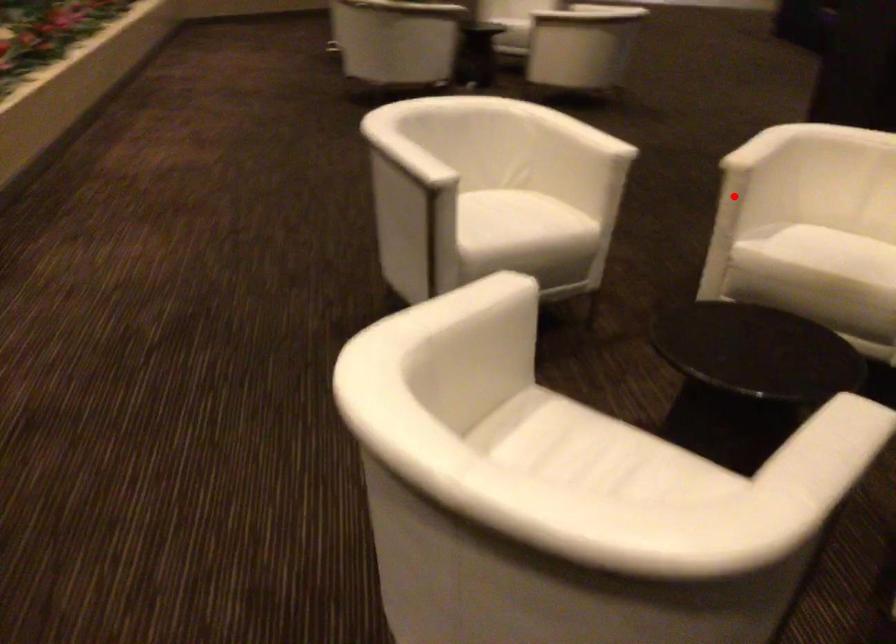
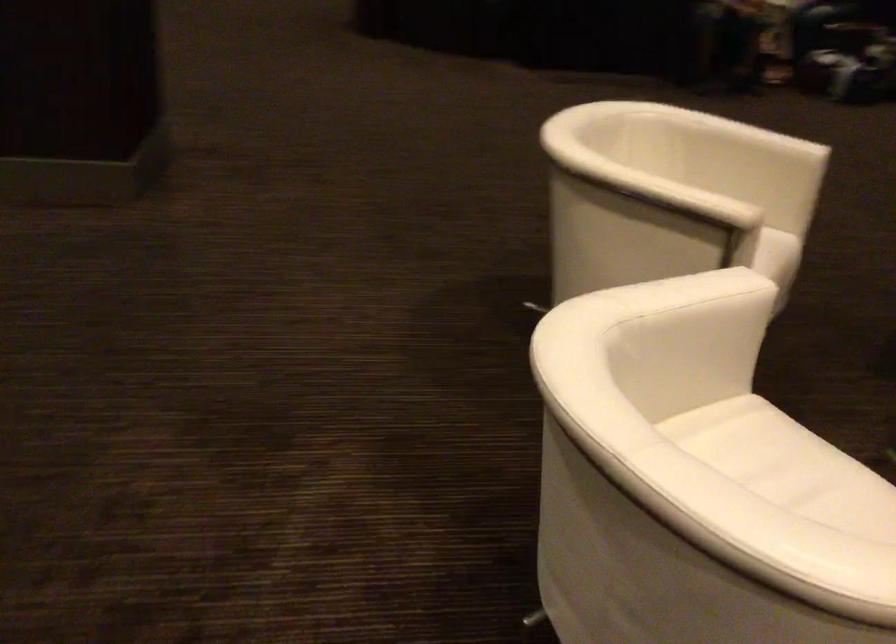
In the second image, find the point that corresponds to the highlighted location in the first image.

(676, 261)